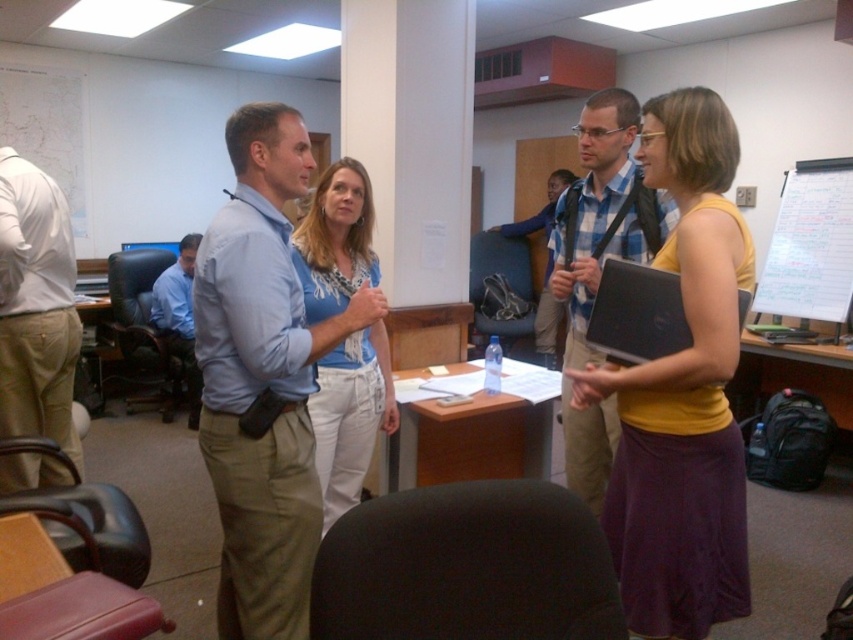
Question: Is light blue shirt at center thinner than white matte shirt at left?

Choices:
 (A) no
 (B) yes

Answer: (A)

Question: Which point is closer to the camera?

Choices:
 (A) whiteboard at upper right
 (B) blue plaid shirt at center
 (C) blue shirt at left
 (D) blue cotton shirt at center

Answer: (D)

Question: Does black fabric swivel chair at center have a larger size compared to blue plaid shirt at center?

Choices:
 (A) no
 (B) yes

Answer: (A)

Question: Which point appears farthest from the camera in this image?

Choices:
 (A) (15, 420)
 (B) (587, 385)

Answer: (A)

Question: Is white matte shirt at left thinner than whiteboard at upper right?

Choices:
 (A) yes
 (B) no

Answer: (A)

Question: Which point is closer to the camera taking this photo?

Choices:
 (A) (276, 243)
 (B) (583, 230)

Answer: (A)